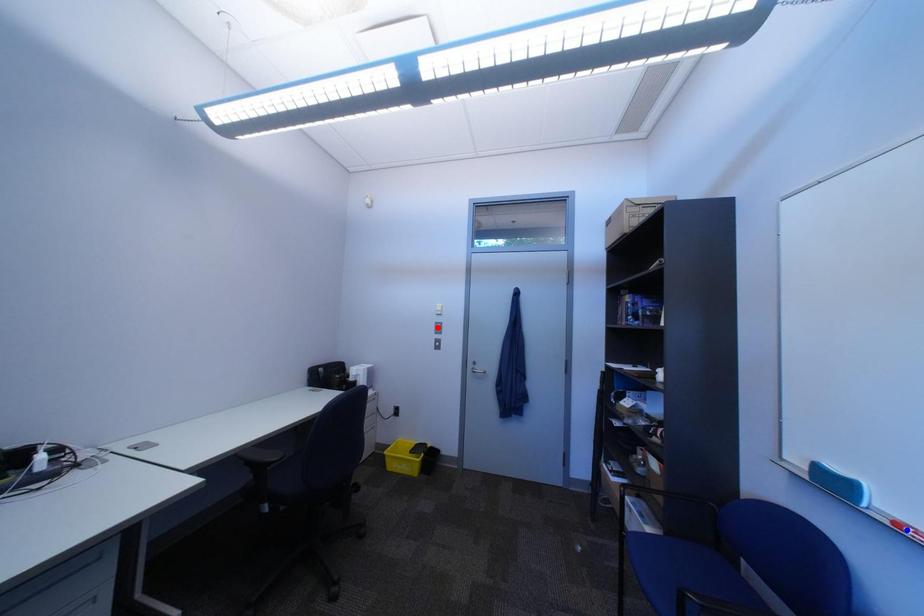
Question: Which of the two points in the image is closer to the camera?

Choices:
 (A) Blue point is closer.
 (B) Red point is closer.

Answer: (A)